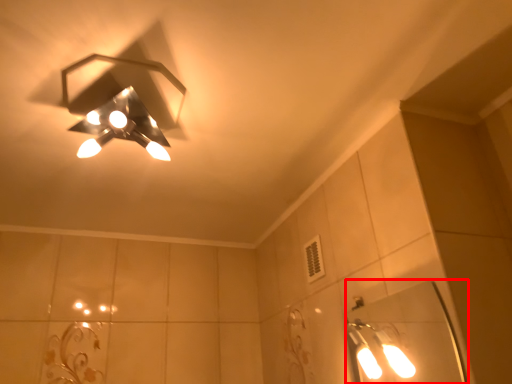
Question: From the image's perspective, considering the relative positions of mirror (annotated by the red box) and lamp in the image provided, where is mirror (annotated by the red box) located with respect to the staircase?

Choices:
 (A) below
 (B) above

Answer: (A)